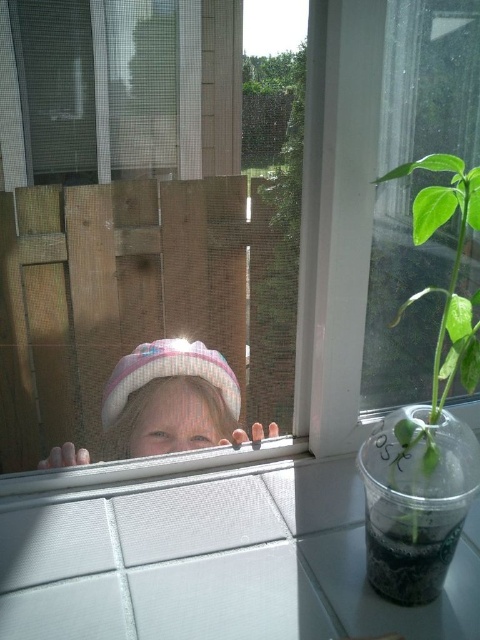
You are standing inside the room and looking through the window. There is a point marked at coordinates (171, 400). What object is located at that point?

The pink woolen hat at center is located at point (171, 400).

You are standing inside the room looking through the window. You see the pink woolen hat at center and the green leafy plant at right. Which object is closer to the left side of the window?

The pink woolen hat at center is closer to the left side of the window because it is positioned to the left of the green leafy plant at right.

You are standing inside the room looking through the window. You see the pink woolen hat at center and the green leafy plant at right. Which object is taller?

The green leafy plant at right is taller than the pink woolen hat at center.